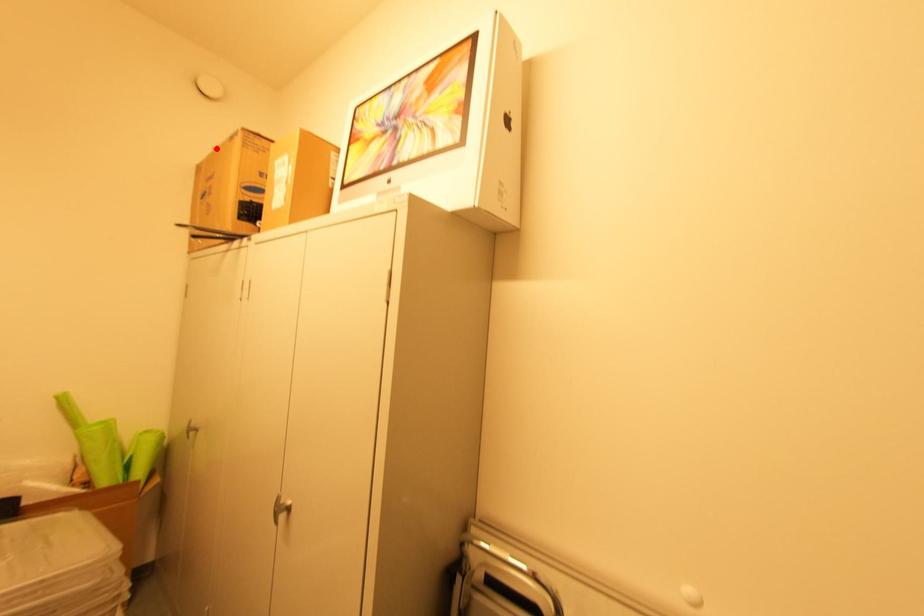
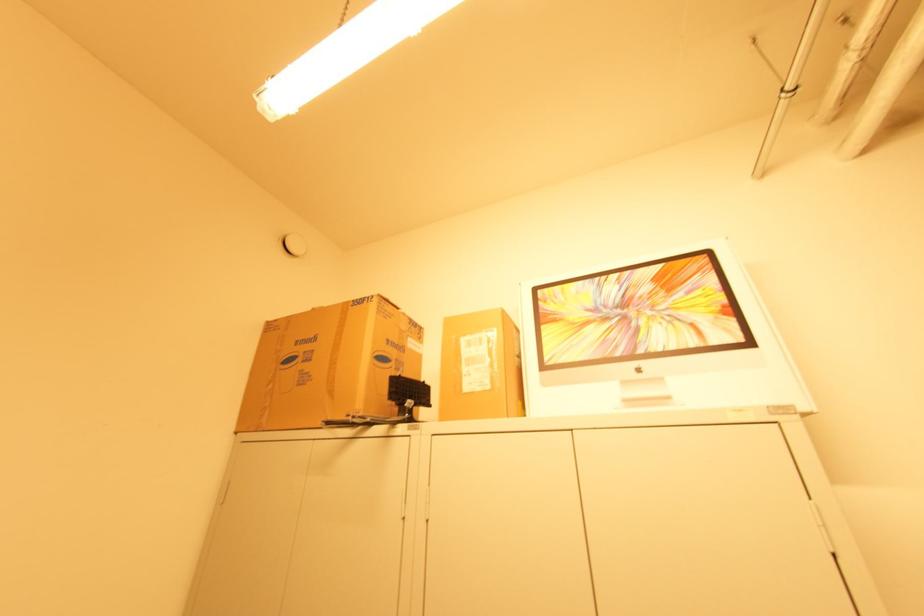
In the second image, find the point that corresponds to the highlighted location in the first image.

(315, 309)